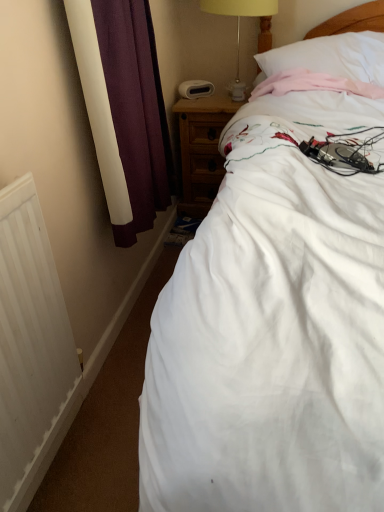
Question: Is white matte radiator at lower left with white cotton bed at center?

Choices:
 (A) no
 (B) yes

Answer: (A)

Question: From a real-world perspective, is white matte radiator at lower left physically above white cotton bed at center?

Choices:
 (A) no
 (B) yes

Answer: (A)

Question: Is white matte radiator at lower left bigger than white cotton bed at center?

Choices:
 (A) yes
 (B) no

Answer: (B)

Question: Does white matte radiator at lower left have a lesser height compared to white cotton bed at center?

Choices:
 (A) no
 (B) yes

Answer: (B)

Question: Is white matte radiator at lower left oriented away from white cotton bed at center?

Choices:
 (A) no
 (B) yes

Answer: (A)

Question: Is white matte radiator at lower left not inside white cotton bed at center?

Choices:
 (A) no
 (B) yes

Answer: (B)

Question: Does white matte radiator at lower left lie in front of white soft pillow at upper right?

Choices:
 (A) yes
 (B) no

Answer: (A)

Question: Is white soft pillow at upper right at the back of white matte radiator at lower left?

Choices:
 (A) no
 (B) yes

Answer: (A)

Question: Does white matte radiator at lower left have a greater width compared to white soft pillow at upper right?

Choices:
 (A) no
 (B) yes

Answer: (A)

Question: Does white matte radiator at lower left appear on the right side of white soft pillow at upper right?

Choices:
 (A) yes
 (B) no

Answer: (B)

Question: Is white matte radiator at lower left to the left of white soft pillow at upper right from the viewer's perspective?

Choices:
 (A) no
 (B) yes

Answer: (B)

Question: Is white matte radiator at lower left shorter than white soft pillow at upper right?

Choices:
 (A) no
 (B) yes

Answer: (A)

Question: Is yellow fabric lampshade at upper center located within white soft pillow at upper right?

Choices:
 (A) yes
 (B) no

Answer: (B)